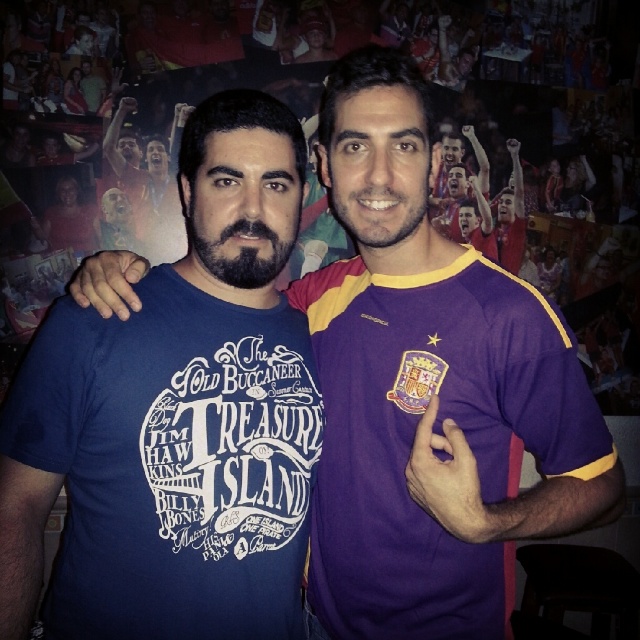
Question: Which of the following is the closest to the observer?

Choices:
 (A) (58, 369)
 (B) (397, 280)

Answer: (A)

Question: Observing the image, what is the correct spatial positioning of blue cotton t-shirt at center in reference to purple jersey at right?

Choices:
 (A) above
 (B) below

Answer: (A)

Question: Which point appears closest to the camera in this image?

Choices:
 (A) (80, 508)
 (B) (476, 547)

Answer: (A)

Question: Considering the relative positions of blue cotton t-shirt at center and purple jersey at right in the image provided, where is blue cotton t-shirt at center located with respect to purple jersey at right?

Choices:
 (A) below
 (B) above

Answer: (B)

Question: In this image, where is blue cotton t-shirt at center located relative to purple jersey at right?

Choices:
 (A) right
 (B) left

Answer: (B)